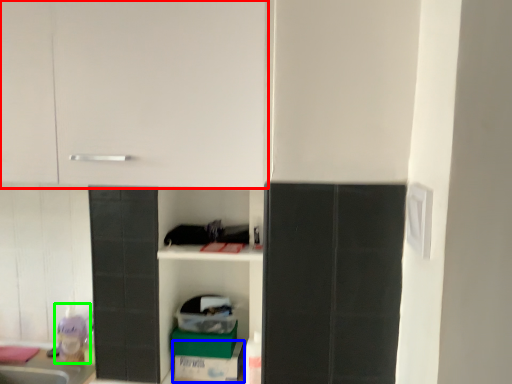
Question: Which object is the closest to the cabinetry (highlighted by a red box)? Choose among these: cardboard box (highlighted by a blue box) or toy (highlighted by a green box).

Choices:
 (A) cardboard box
 (B) toy

Answer: (A)